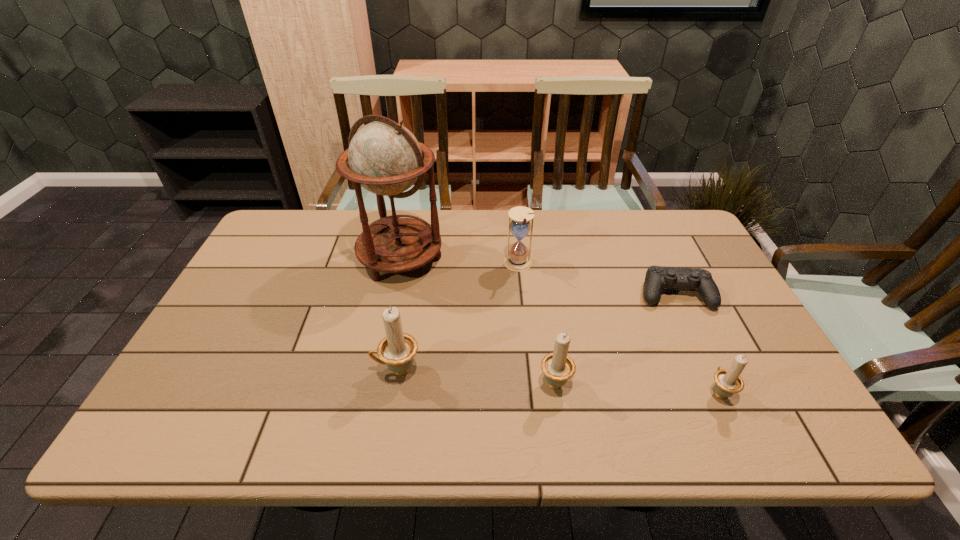
Where is `the leftmost candle_holder`? This screenshot has height=540, width=960. the leftmost candle_holder is located at coordinates (396, 350).

Identify the location of the second tallest candle_holder. (558, 367).

At what (x,y) coordinates should I click in order to perform the action: click on the second candle_holder from left to right. Please return your answer as a coordinate pair (x, y). Image resolution: width=960 pixels, height=540 pixels. Looking at the image, I should click on (558, 367).

Find the location of a particular element. the shortest candle_holder is located at coordinates (728, 382).

The height and width of the screenshot is (540, 960). In order to click on the rightmost candle_holder in this screenshot , I will do `click(728, 382)`.

Image resolution: width=960 pixels, height=540 pixels. Identify the location of hourglass. (517, 259).

At what (x,y) coordinates should I click in order to perform the action: click on globe. Please return your answer as a coordinate pair (x, y). Looking at the image, I should click on (384, 157).

This screenshot has width=960, height=540. Identify the location of the shortest object. (657, 277).

This screenshot has height=540, width=960. I want to click on free space located 0.350m on the handle side of the tallest candle_holder, so click(x=227, y=370).

This screenshot has height=540, width=960. In order to click on blank area located on the handle side of the tallest candle_holder in this screenshot , I will do coord(298,370).